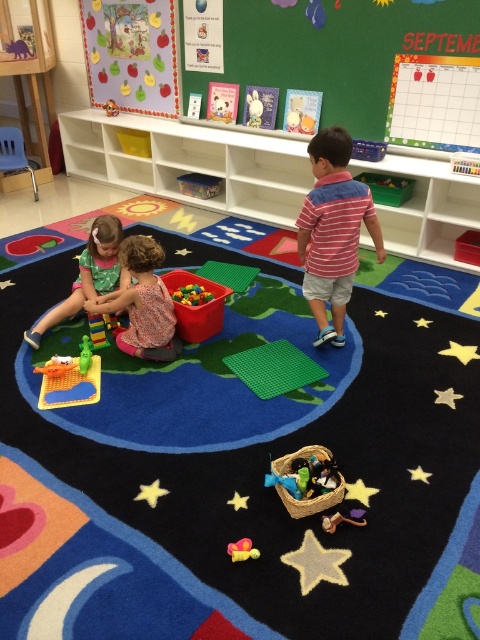
You are a teacher in the classroom and want to place a new poster on the wall. The poster needs to be placed between the two points marked as point (357, 204) and point (231, 545). Which point should be the starting point if you want the poster to be closer to the front of the classroom?

Point (231, 545) should be the starting point because it is in front of point (357, 204), so placing the poster closer to this point will position it nearer to the front of the classroom.

You are a student sitting at your desk in the classroom and want to reach both the point at coordinates (103, 236) and the point at (255, 554). Which point will you reach first if you move directly towards them?

You will reach the point at coordinates (103, 236) first because it is closer to you than the point at (255, 554).

You are a teacher in the classroom and want to pick up both the green fabric dress at lower left and the rubber duck at lower center. Which object should you reach for first to pick up the one closer to you?

The green fabric dress at lower left is closer to you, so you should reach for it first.